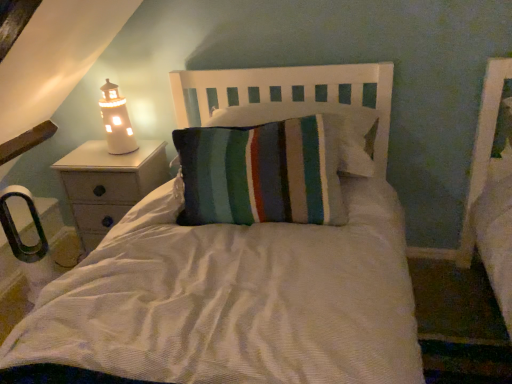
Identify the location of free space to the right of white ceramic lighthouse at left. The image size is (512, 384). (152, 148).